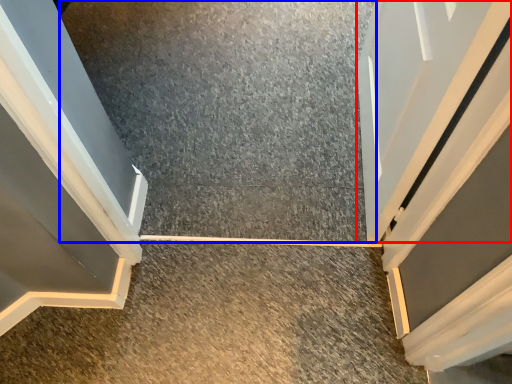
Question: Which object is closer to the camera taking this photo, door (highlighted by a red box) or concrete (highlighted by a blue box)?

Choices:
 (A) door
 (B) concrete

Answer: (A)